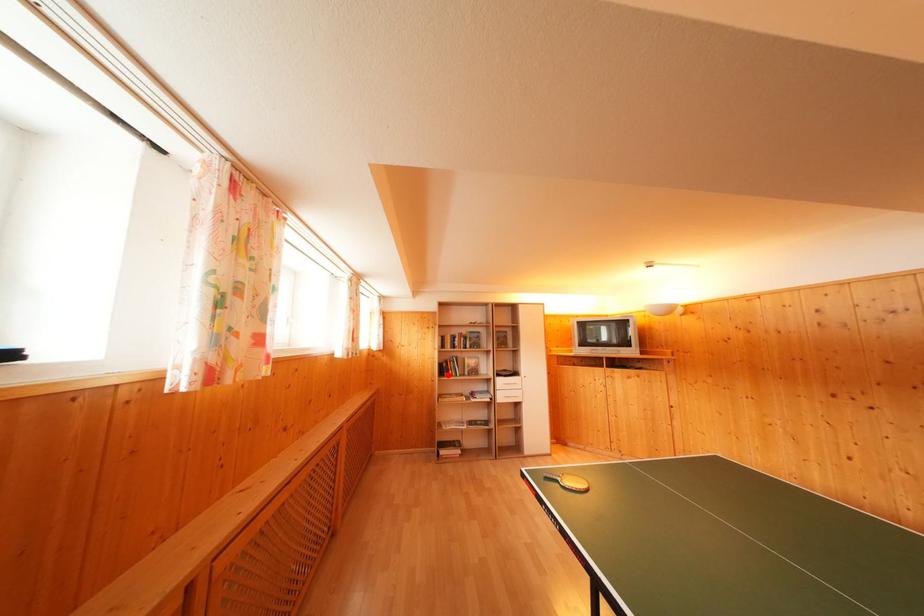
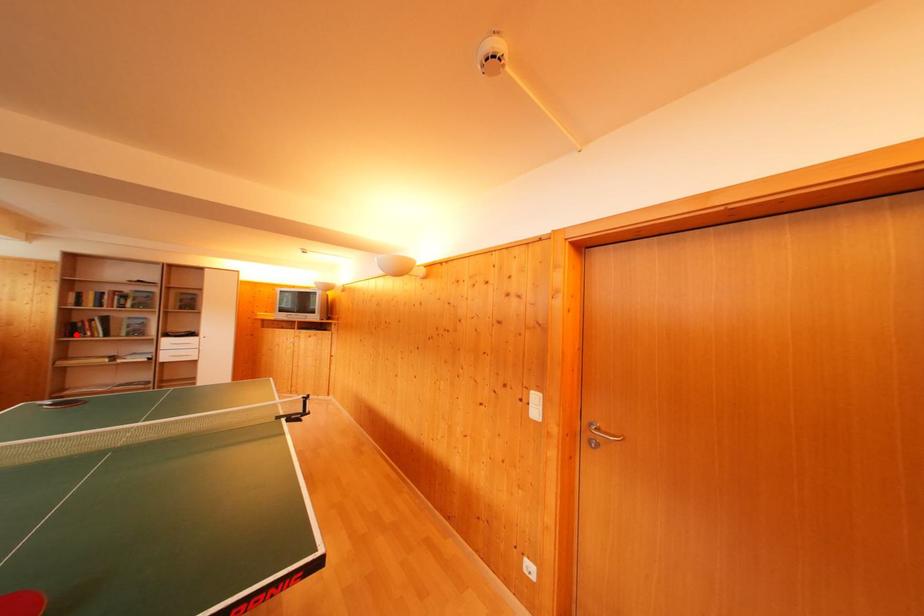
I am providing you with two images of the same scene from different viewpoints. A red point is marked on the first image and another point is marked on the second image. Is the red point in image1 aligned with the point shown in image2?

Yes